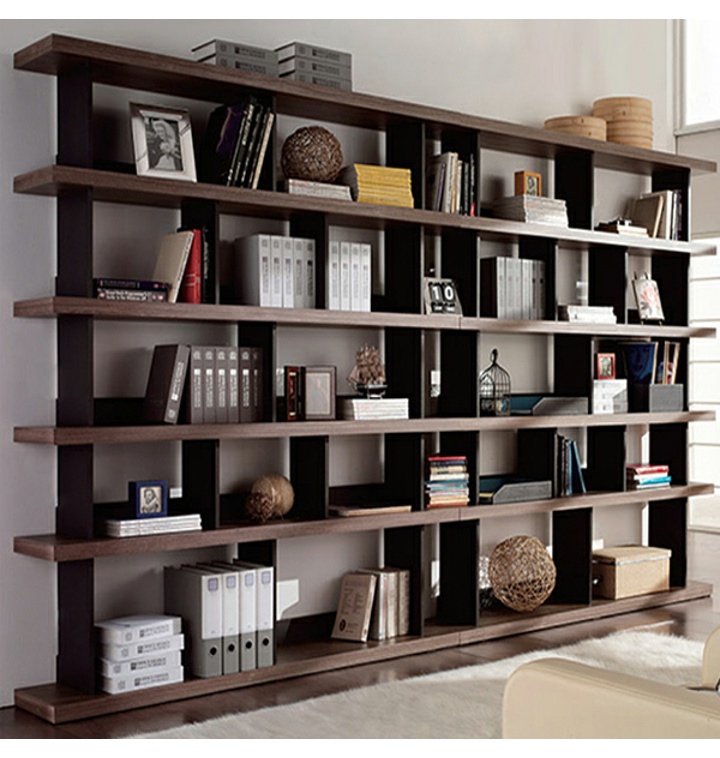
This screenshot has width=720, height=758. Identify the location of pictures. (160, 136), (148, 505), (533, 177), (605, 365), (315, 393), (289, 390).